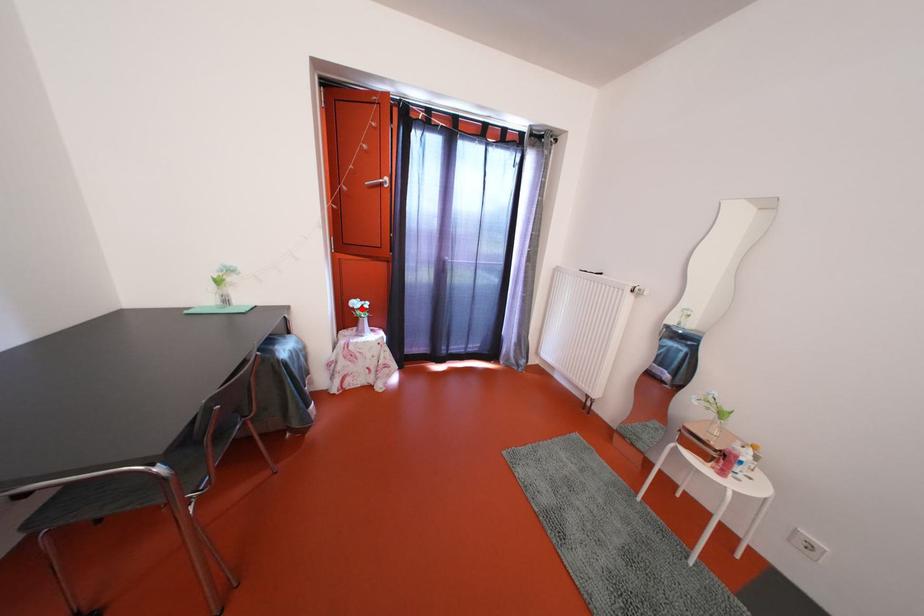
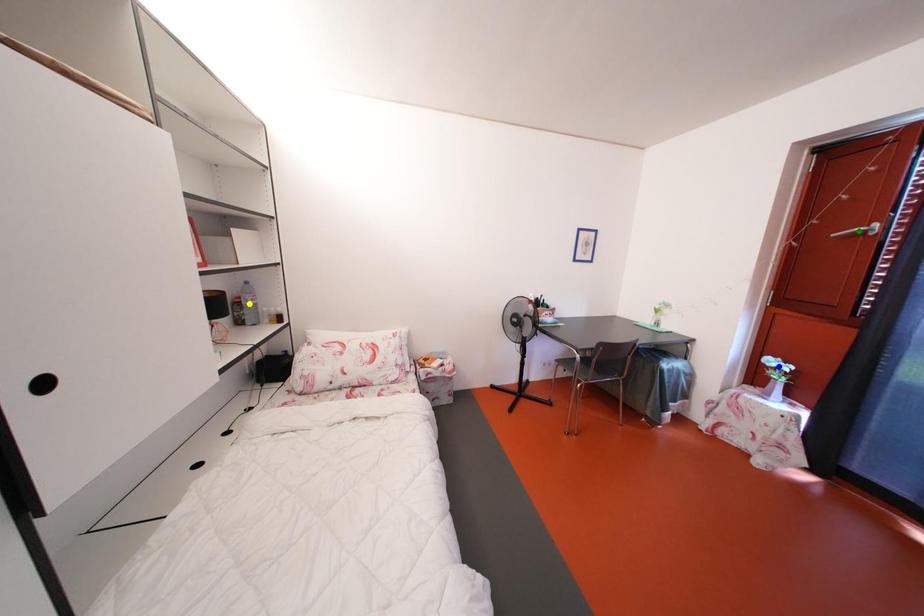
Question: I am providing you with two images of the same scene from different viewpoints. A red point is marked on the first image. You are given multiple points on the second image. In image 2, which mark is for the same physical point as the one in image 1?

Choices:
 (A) blue point
 (B) yellow point
 (C) green point

Answer: (A)